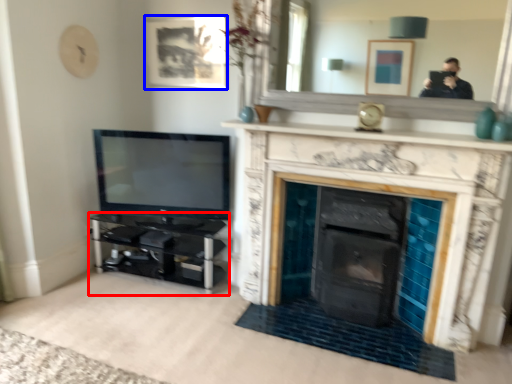
Question: Which point is further to the camera, entertainment center (highlighted by a red box) or picture frame (highlighted by a blue box)?

Choices:
 (A) entertainment center
 (B) picture frame

Answer: (B)